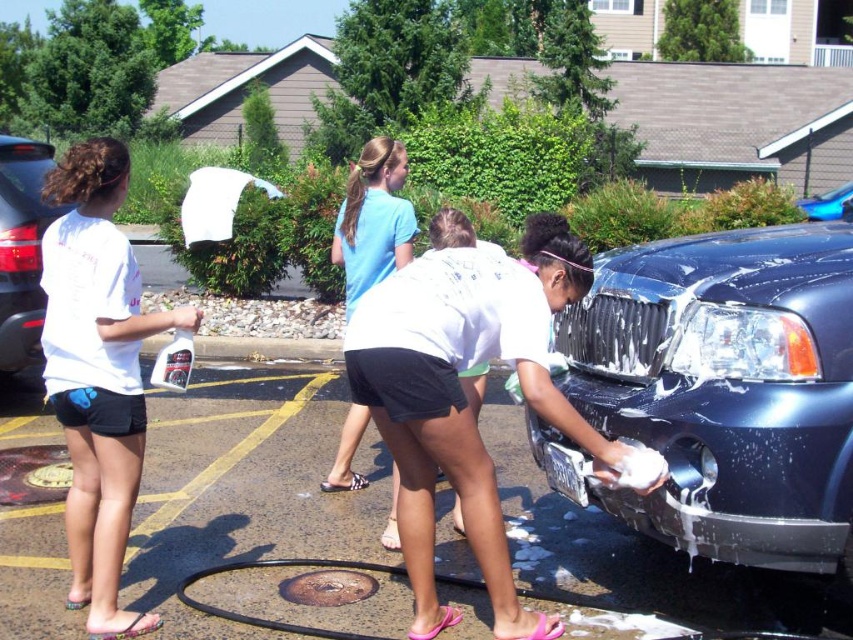
Question: Which point is closer to the camera?

Choices:
 (A) (822, 202)
 (B) (585, 374)
 (C) (468, 490)
 (D) (125, 310)

Answer: (C)

Question: Is light blue t-shirt at center thinner than matte black car at left?

Choices:
 (A) no
 (B) yes

Answer: (B)

Question: Considering the relative positions of white matte shirt at left and glossy blue car at right in the image provided, where is white matte shirt at left located with respect to glossy blue car at right?

Choices:
 (A) left
 (B) right

Answer: (A)

Question: Is white matte shirt at center above glossy blue car at right?

Choices:
 (A) no
 (B) yes

Answer: (A)

Question: Which is nearer to the glossy blue car at right?

Choices:
 (A) glossy black car at lower right
 (B) matte black car at left
 (C) light blue t-shirt at center

Answer: (A)

Question: Which object appears closest to the camera in this image?

Choices:
 (A) glossy black car at lower right
 (B) glossy blue car at right

Answer: (A)